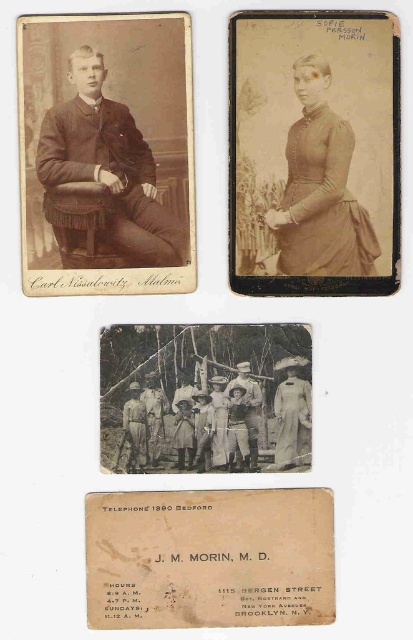
Question: Which point is closer to the camera?

Choices:
 (A) black and white photograph of group at center
 (B) vintage paper postcard at center
 (C) khaki cotton uniform at center
 (D) light beige fabric dress at center

Answer: (B)

Question: Can you confirm if vintage paper postcard at center is thinner than black and white photograph of group at center?

Choices:
 (A) yes
 (B) no

Answer: (B)

Question: Can you confirm if light beige fabric dress at center is smaller than khaki cotton uniform at center?

Choices:
 (A) no
 (B) yes

Answer: (A)

Question: Which point is closer to the camera taking this photo?

Choices:
 (A) (206, 512)
 (B) (135, 349)

Answer: (A)

Question: Does light beige fabric dress at center have a greater width compared to khaki cotton uniform at center?

Choices:
 (A) no
 (B) yes

Answer: (B)

Question: Among these points, which one is nearest to the camera?

Choices:
 (A) (142, 368)
 (B) (294, 417)
 (C) (242, 380)
 (D) (47, 154)

Answer: (D)